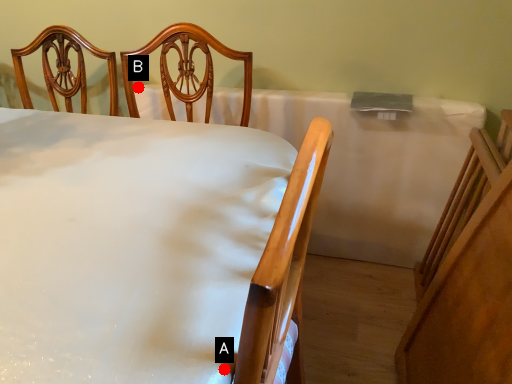
Question: Two points are circled on the image, labeled by A and B beside each circle. Which point is closer to the camera taking this photo?

Choices:
 (A) A is closer
 (B) B is closer

Answer: (A)